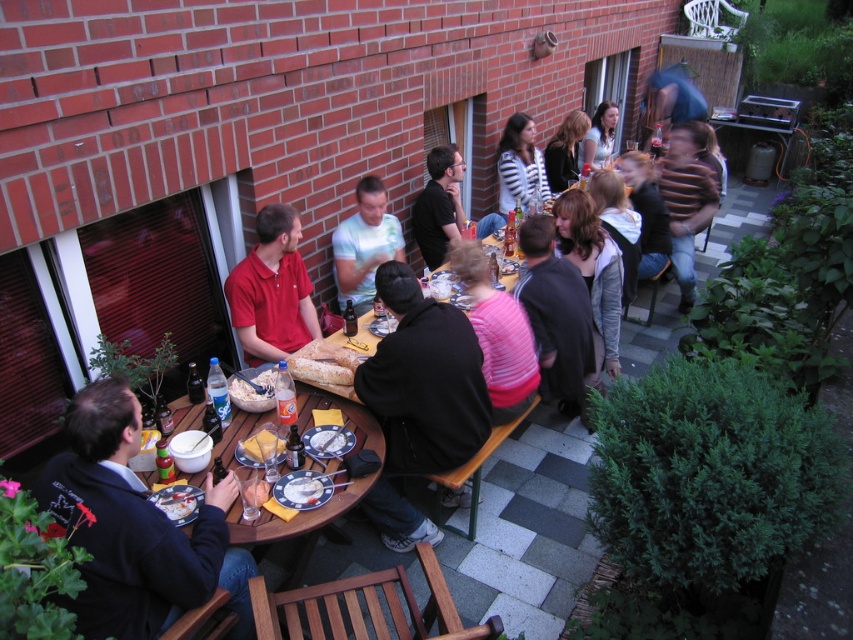
Question: Considering the relative positions of dark blue cotton jacket at lower left and white matte bowl at center in the image provided, where is dark blue cotton jacket at lower left located with respect to white matte bowl at center?

Choices:
 (A) left
 (B) right

Answer: (A)

Question: Is slightly toasted bread at table center bigger than dark brown hair at upper center?

Choices:
 (A) no
 (B) yes

Answer: (A)

Question: Which object is the farthest from the white glossy bowl at lower left?

Choices:
 (A) yellow cheese at table center
 (B) brown striped sweater at upper right
 (C) smooth white plate at table center
 (D) dark brown hair at upper center

Answer: (D)

Question: Can you confirm if white shirt at upper center is smaller than yellow cheese at table center?

Choices:
 (A) yes
 (B) no

Answer: (B)

Question: Which object appears farthest from the camera in this image?

Choices:
 (A) white shirt at upper center
 (B) slightly toasted bread at table center
 (C) smooth white plate at table center

Answer: (A)

Question: Among these objects, which one is farthest from the camera?

Choices:
 (A) white matte bowl at center
 (B) smooth white plate at table center
 (C) brown striped sweater at upper right
 (D) smooth yellow cheese at lower center

Answer: (C)